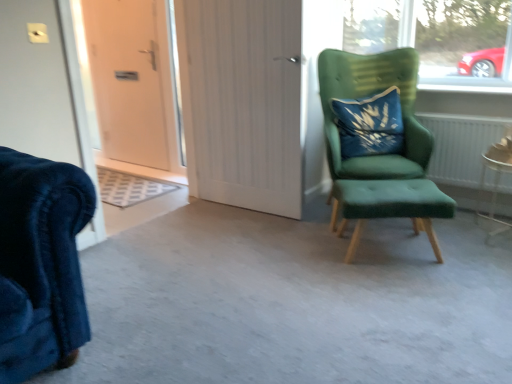
Locate an element on the screen. This screenshot has height=384, width=512. free space between green fabric stool at right and metallic silver side table at lower right is located at coordinates (447, 234).